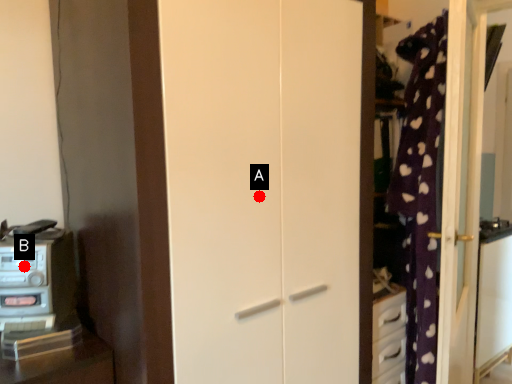
Question: Two points are circled on the image, labeled by A and B beside each circle. Which point appears closest to the camera in this image?

Choices:
 (A) A is closer
 (B) B is closer

Answer: (B)